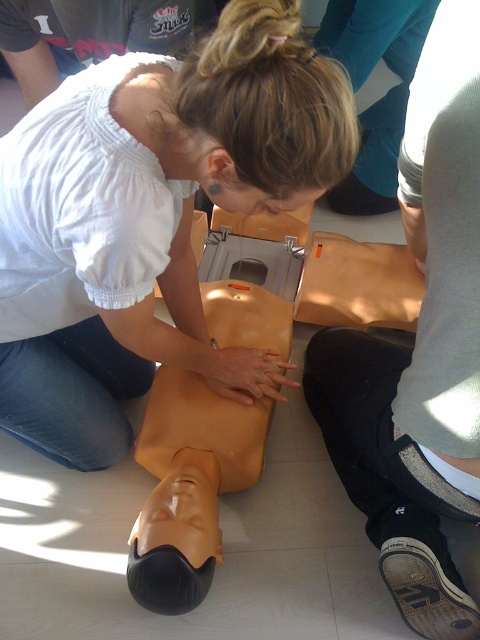
Question: Is matte orange mannequin torso at center to the left of brown canvas shoe at lower right from the viewer's perspective?

Choices:
 (A) yes
 (B) no

Answer: (B)

Question: In this image, where is matte orange mannequin torso at center located relative to brown canvas shoe at lower right?

Choices:
 (A) above
 (B) below

Answer: (A)

Question: Based on their relative distances, which object is farther from the matte orange mannequin torso at center?

Choices:
 (A) matte yellow mannequin at center
 (B) brown canvas shoe at lower right

Answer: (A)

Question: Can you confirm if matte orange mannequin torso at center is thinner than brown canvas shoe at lower right?

Choices:
 (A) no
 (B) yes

Answer: (A)

Question: Which point appears farthest from the camera in this image?

Choices:
 (A) (113, 216)
 (B) (433, 573)

Answer: (B)

Question: Which point is farther to the camera?

Choices:
 (A) matte orange mannequin torso at center
 (B) brown canvas shoe at lower right
 (C) matte yellow mannequin at center

Answer: (B)